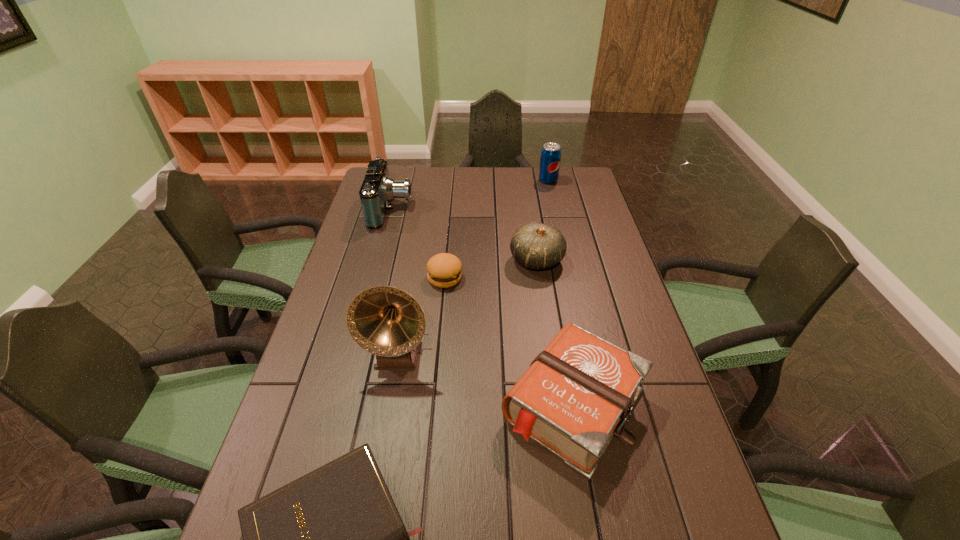
Where is `object that stands as the fourth closest to the pop soda`? Image resolution: width=960 pixels, height=540 pixels. object that stands as the fourth closest to the pop soda is located at coordinates (576, 395).

Where is `free space in the image that satisfies the following two spatial constraints: 1. on the horn of the tallest object; 2. on the right side of the right Bible`? This screenshot has height=540, width=960. free space in the image that satisfies the following two spatial constraints: 1. on the horn of the tallest object; 2. on the right side of the right Bible is located at coordinates (388, 406).

The image size is (960, 540). I want to click on blank area in the image that satisfies the following two spatial constraints: 1. on the front side of the taller Bible; 2. on the right side of the hamburger, so click(x=434, y=406).

Identify the location of vacant area in the image that satisfies the following two spatial constraints: 1. on the horn of the taller Bible; 2. on the right side of the phonograph record. Image resolution: width=960 pixels, height=540 pixels. (388, 406).

I want to click on free space that satisfies the following two spatial constraints: 1. on the back side of the farthest object; 2. on the left side of the gourd, so click(525, 180).

You are a GUI agent. You are given a task and a screenshot of the screen. Output one action in this format:
    pyautogui.click(x=<x>, y=<y>)
    Task: Click on the free location that satisfies the following two spatial constraints: 1. on the front-facing side of the gourd; 2. on the right side of the camcorder
    The height and width of the screenshot is (540, 960).
    Given the screenshot: What is the action you would take?
    pyautogui.click(x=377, y=260)

The height and width of the screenshot is (540, 960). Identify the location of free spot that satisfies the following two spatial constraints: 1. on the back side of the gourd; 2. on the front-facing side of the camcorder. (529, 209).